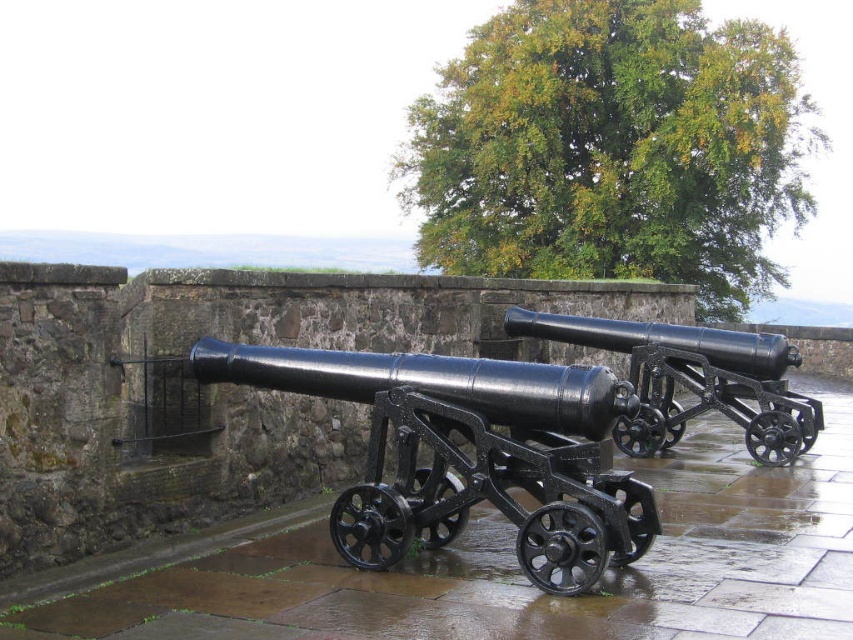
Based on the scene description, where is the matte black cannon at center located in terms of coordinates?

The matte black cannon at center is located at coordinates point (466, 452).

You are standing in front of the cannons on the stone platform. There are two points marked in the image. Which point, point (468, 378) or point (746, 369), is closer to you?

Point (468, 378) is closer to the camera than point (746, 369), so the point closer to you is point (468, 378).